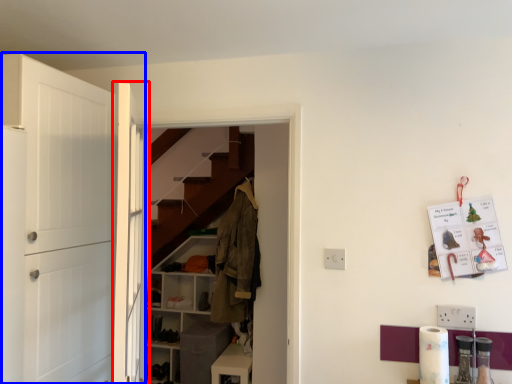
Question: Which of the following is the closest to the observer, door (highlighted by a red box) or door (highlighted by a blue box)?

Choices:
 (A) door
 (B) door

Answer: (A)